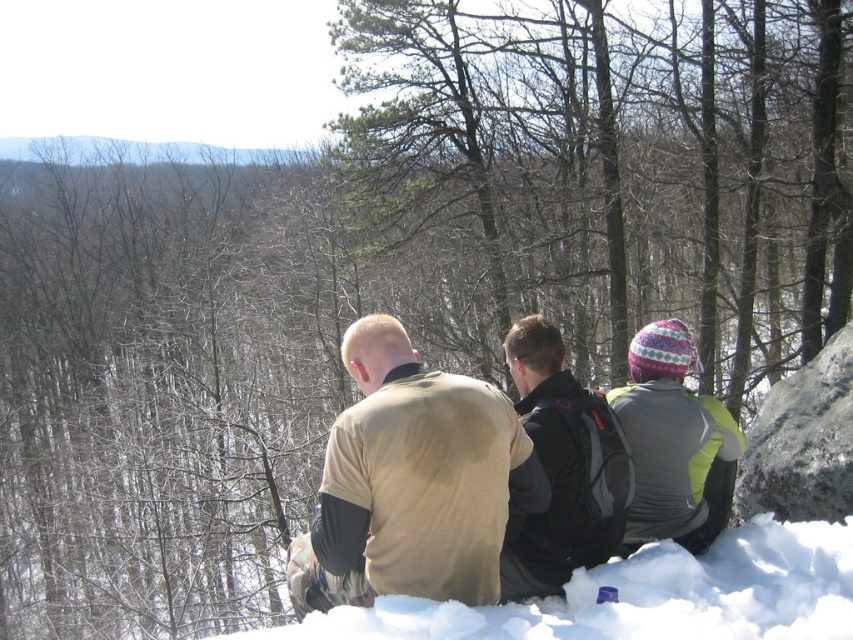
Which is more to the right, smooth bark tree at center or tan fabric jacket at center?

smooth bark tree at center is more to the right.

Between smooth bark tree at center and tan fabric jacket at center, which one is positioned higher?

smooth bark tree at center

Is point (627, 88) positioned in front of point (323, 476)?

No, it is behind (323, 476).

The height and width of the screenshot is (640, 853). What are the coordinates of `smooth bark tree at center` in the screenshot? It's located at (614, 157).

Between tan fabric jacket at center and black matte jacket at center, which one appears on the right side from the viewer's perspective?

black matte jacket at center

Is point (339, 547) in front of point (567, 548)?

That is True.

I want to click on tan fabric jacket at center, so click(x=412, y=483).

Does black matte jacket at center have a greater width compared to gray rough rock at right?

In fact, black matte jacket at center might be narrower than gray rough rock at right.

Looking at this image, is black matte jacket at center positioned before gray rough rock at right?

Yes, black matte jacket at center is closer to the viewer.

What are the coordinates of `black matte jacket at center` in the screenshot? It's located at (561, 468).